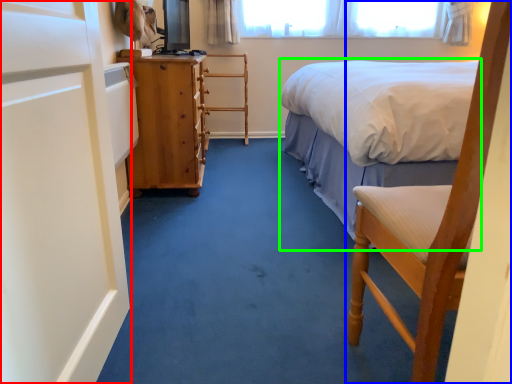
Question: Based on their relative distances, which object is nearer to screen door (highlighted by a red box)? Choose from chair (highlighted by a blue box) and bed (highlighted by a green box).

Choices:
 (A) chair
 (B) bed

Answer: (A)